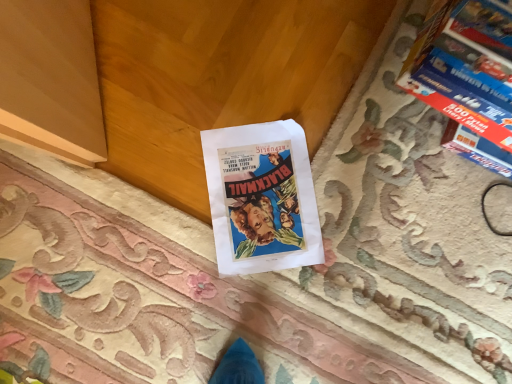
Locate an element on the screen. blue glossy book at upper right is located at coordinates (467, 77).

The width and height of the screenshot is (512, 384). What do you see at coordinates (467, 77) in the screenshot?
I see `blue glossy book at upper right` at bounding box center [467, 77].

Locate an element on the screen. Image resolution: width=512 pixels, height=384 pixels. vintage paper poster at center is located at coordinates (261, 198).

This screenshot has width=512, height=384. Describe the element at coordinates (261, 198) in the screenshot. I see `vintage paper poster at center` at that location.

Where is `blue glossy book at upper right`? The image size is (512, 384). blue glossy book at upper right is located at coordinates (467, 77).

Can you confirm if blue glossy book at upper right is positioned to the left of vintage paper poster at center?

No, blue glossy book at upper right is not to the left of vintage paper poster at center.

Is the depth of blue glossy book at upper right greater than that of vintage paper poster at center?

No, blue glossy book at upper right is closer to the viewer.

Considering the positions of point (483, 133) and point (284, 243), is point (483, 133) closer or farther from the camera than point (284, 243)?

Point (483, 133).

From the image's perspective, is blue glossy book at upper right positioned above or below vintage paper poster at center?

blue glossy book at upper right is situated higher than vintage paper poster at center in the image.

From a real-world perspective, between blue glossy book at upper right and vintage paper poster at center, who is vertically lower?

In real-world perspective, vintage paper poster at center is lower.

Considering the sizes of objects blue glossy book at upper right and vintage paper poster at center in the image provided, who is thinner, blue glossy book at upper right or vintage paper poster at center?

vintage paper poster at center.

Who is shorter, blue glossy book at upper right or vintage paper poster at center?

With less height is vintage paper poster at center.

Based on the photo, considering the sizes of objects blue glossy book at upper right and vintage paper poster at center in the image provided, who is bigger, blue glossy book at upper right or vintage paper poster at center?

Bigger between the two is blue glossy book at upper right.

Is vintage paper poster at center completely or partially inside blue glossy book at upper right?

No, vintage paper poster at center is not inside blue glossy book at upper right.

Are blue glossy book at upper right and vintage paper poster at center located far from each other?

Actually, blue glossy book at upper right and vintage paper poster at center are a little close together.

Could you tell me if blue glossy book at upper right is facing vintage paper poster at center?

No, blue glossy book at upper right is not turned towards vintage paper poster at center.

The width and height of the screenshot is (512, 384). I want to click on book that appears below the blue glossy book at upper right (from a real-world perspective), so click(261, 198).

In the scene shown: Between vintage paper poster at center and blue glossy book at upper right, which one appears on the left side from the viewer's perspective?

Positioned to the left is vintage paper poster at center.

Is vintage paper poster at center behind blue glossy book at upper right?

Yes, it is behind blue glossy book at upper right.

Considering the points (251, 167) and (498, 150), which point is behind, point (251, 167) or point (498, 150)?

The point (251, 167) is more distant.

From the image's perspective, is vintage paper poster at center above blue glossy book at upper right?

Actually, vintage paper poster at center appears below blue glossy book at upper right in the image.

From a real-world perspective, is vintage paper poster at center positioned under blue glossy book at upper right based on gravity?

Indeed, from a real-world perspective, vintage paper poster at center is positioned beneath blue glossy book at upper right.

In the scene shown: Between vintage paper poster at center and blue glossy book at upper right, which one has smaller width?

vintage paper poster at center is thinner.

Can you confirm if vintage paper poster at center is taller than blue glossy book at upper right?

No, vintage paper poster at center is not taller than blue glossy book at upper right.

Considering the sizes of vintage paper poster at center and blue glossy book at upper right in the image, is vintage paper poster at center bigger or smaller than blue glossy book at upper right?

Clearly, vintage paper poster at center is smaller in size than blue glossy book at upper right.

In the scene shown: Is blue glossy book at upper right completely or partially inside vintage paper poster at center?

No.

Is vintage paper poster at center not near blue glossy book at upper right?

They are positioned close to each other.

Is vintage paper poster at center oriented away from blue glossy book at upper right?

No.

How much distance is there between vintage paper poster at center and blue glossy book at upper right?

They are 12.97 inches apart.

Locate an element on the screen. This screenshot has width=512, height=384. magazine above the vintage paper poster at center (from a real-world perspective) is located at coordinates (467, 77).

There is a vintage paper poster at center. Find the location of `magazine above it (from a real-world perspective)`. magazine above it (from a real-world perspective) is located at coordinates (467, 77).

I want to click on magazine above the vintage paper poster at center (from the image's perspective), so click(x=467, y=77).